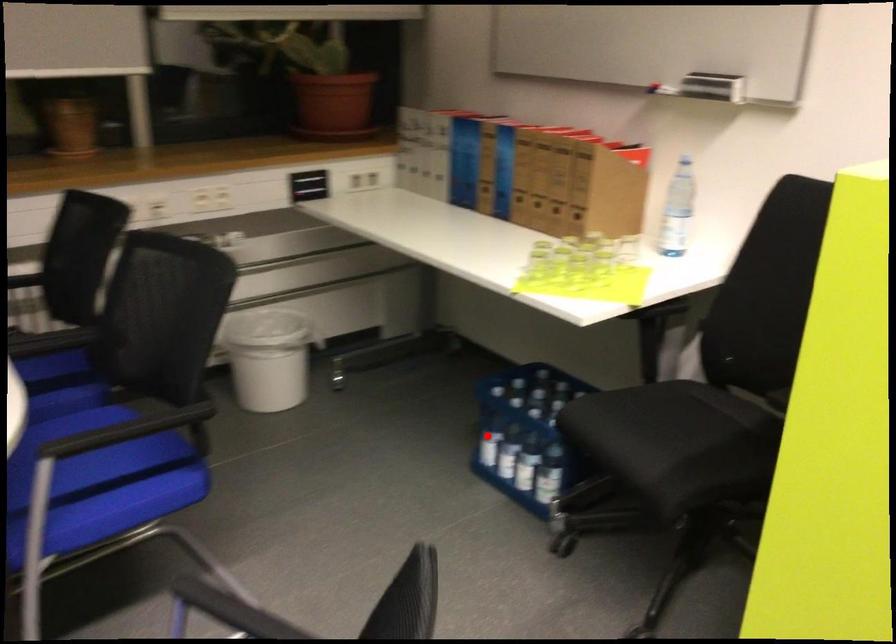
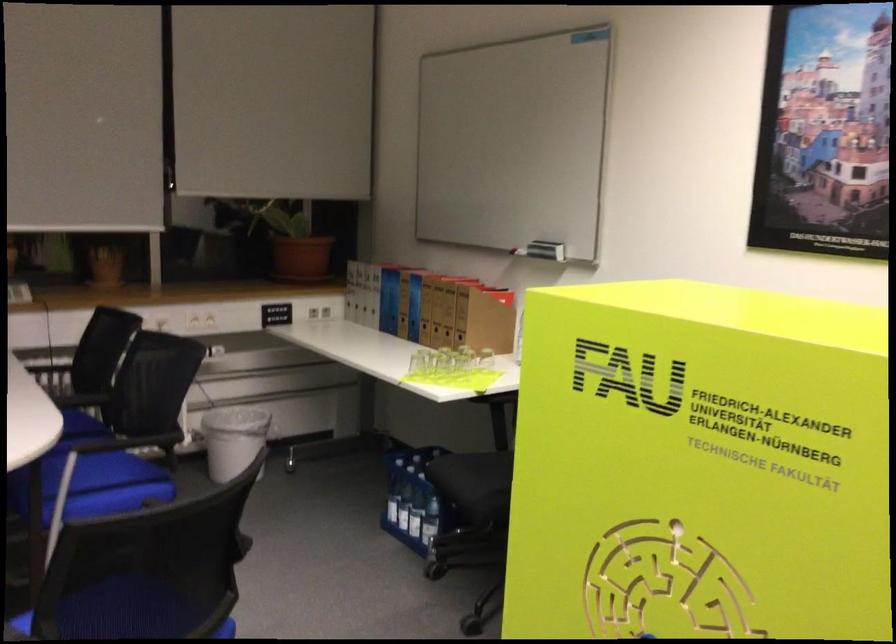
The point at the highlighted location is marked in the first image. Where is the corresponding point in the second image?

(392, 500)